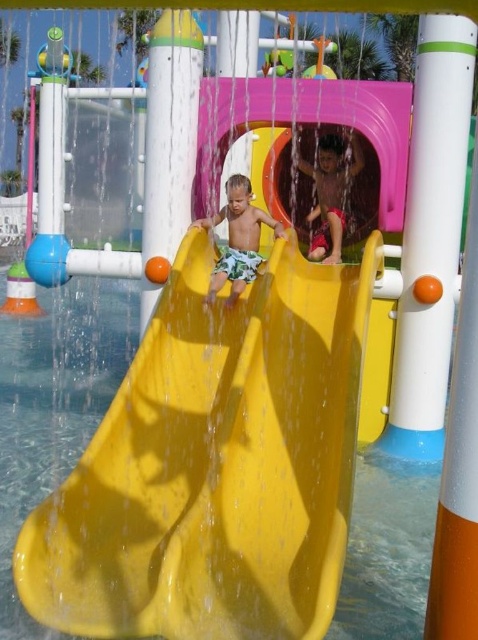
What do you see at coordinates (215, 465) in the screenshot? The height and width of the screenshot is (640, 478). I see `yellow plastic slide at center` at bounding box center [215, 465].

Who is more distant from viewer, (215, 317) or (239, 188)?

The point (239, 188) is behind.

Where is `yellow plastic slide at center`? yellow plastic slide at center is located at coordinates (215, 465).

Is point (153, 352) more distant than point (318, 141)?

That is False.

Does yellow plastic slide at center appear on the right side of matte red shorts at center?

In fact, yellow plastic slide at center is to the left of matte red shorts at center.

Locate an element on the screen. The height and width of the screenshot is (640, 478). yellow plastic slide at center is located at coordinates (215, 465).

Between matte red shorts at center and matte yellow slide at center, which one appears on the left side from the viewer's perspective?

From the viewer's perspective, matte yellow slide at center appears more on the left side.

Can you confirm if matte red shorts at center is positioned to the right of matte yellow slide at center?

Indeed, matte red shorts at center is positioned on the right side of matte yellow slide at center.

The width and height of the screenshot is (478, 640). What do you see at coordinates (330, 193) in the screenshot?
I see `matte red shorts at center` at bounding box center [330, 193].

Where is `matte red shorts at center`? This screenshot has width=478, height=640. matte red shorts at center is located at coordinates (330, 193).